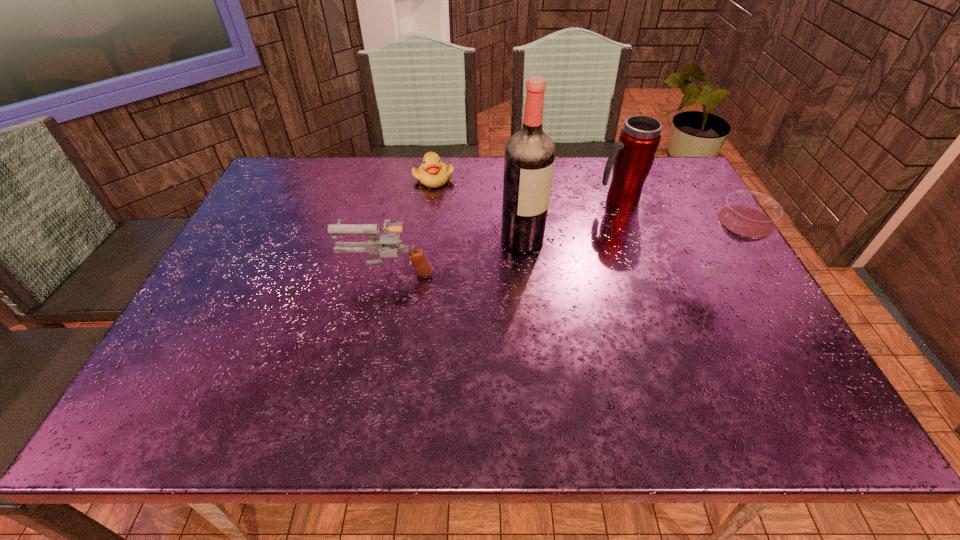
Locate an element on the screen. This screenshot has height=540, width=960. vacant spot on the desktop that is between the gun and the wineglass and is positioned on the front-facing side of the duckling is located at coordinates (520, 271).

Locate an element on the screen. vacant spot on the desktop that is between the gun and the wineglass and is positioned on the front-facing side of the liquor is located at coordinates (592, 272).

The image size is (960, 540). I want to click on vacant spot on the desktop that is between the gun and the third shortest object and is positioned on the side with the handle of the fourth shortest object, so click(575, 272).